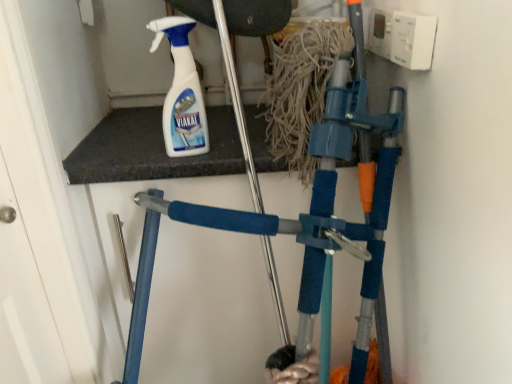
What are the coordinates of `free spot to the left of white plastic spray bottle at upper center` in the screenshot? It's located at (120, 151).